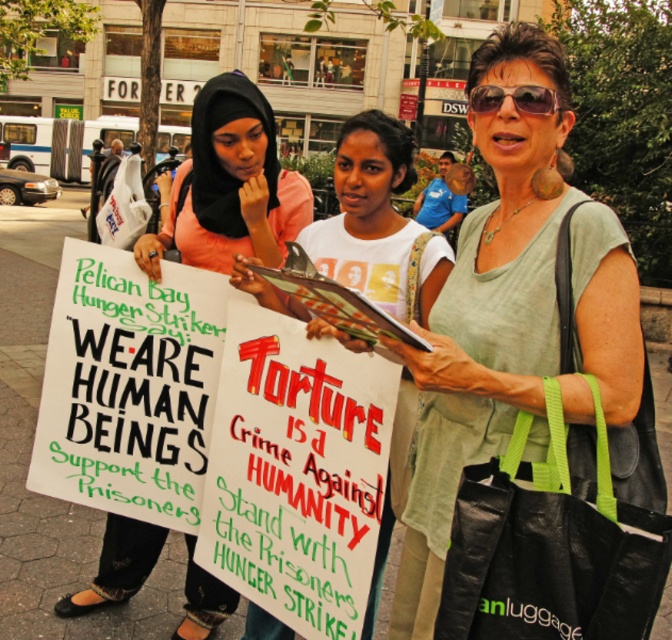
From the picture: Does matte green shirt at center have a greater height compared to matte black hijab at center?

Correct, matte green shirt at center is much taller as matte black hijab at center.

Based on the photo, which is more to the left, matte green shirt at center or matte black hijab at center?

matte black hijab at center

Measure the distance between point (504, 424) and camera.

Point (504, 424) and camera are 1.45 meters apart.

Where is `matte green shirt at center`? The height and width of the screenshot is (640, 672). matte green shirt at center is located at coordinates (489, 317).

Which is above, matte green shirt at center or shiny black sunglasses at center?

shiny black sunglasses at center is above.

Is point (542, 308) farther from camera compared to point (548, 97)?

No, (542, 308) is in front of (548, 97).

Locate an element on the screen. This screenshot has height=640, width=672. matte green shirt at center is located at coordinates (489, 317).

Does matte green shirt at center have a greater width compared to white cotton shirt at center?

Indeed, matte green shirt at center has a greater width compared to white cotton shirt at center.

Does matte green shirt at center appear over white cotton shirt at center?

Incorrect, matte green shirt at center is not positioned above white cotton shirt at center.

Is point (544, 241) more distant than point (411, 145)?

No, (544, 241) is closer to viewer.

Where is `matte green shirt at center`? The image size is (672, 640). matte green shirt at center is located at coordinates (489, 317).